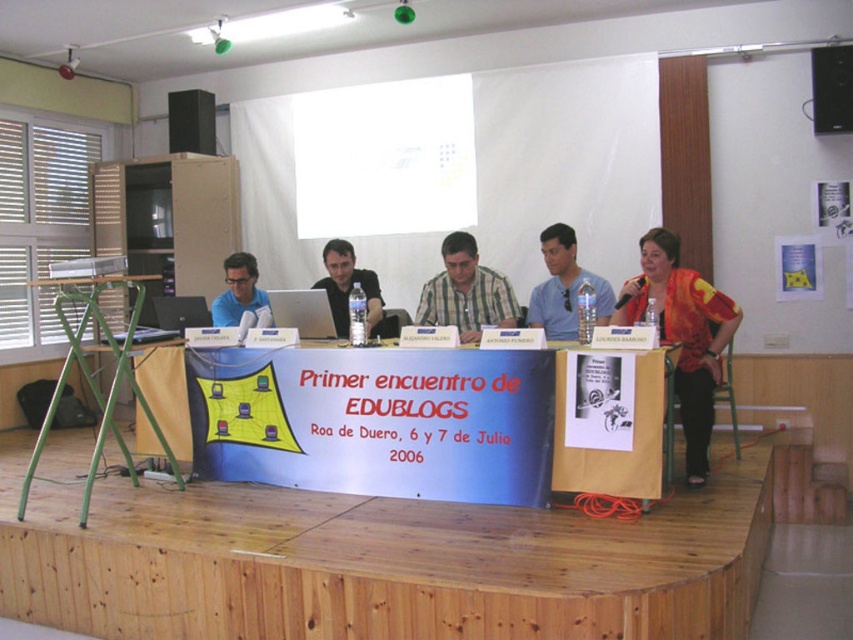
Question: Which is nearer to the orange fabric shirt at right?

Choices:
 (A) white cardboard table at center
 (B) black plastic speaker at upper left
 (C) black plastic speaker at upper right
 (D) green metal table at left

Answer: (A)

Question: Which of these objects is positioned farthest from the matte blue shirt at left?

Choices:
 (A) matte blue shirt at center
 (B) checkered fabric shirt at center
 (C) matte black laptop at center

Answer: (A)

Question: Can you confirm if checkered fabric shirt at center is positioned below silver metallic laptop at center?

Choices:
 (A) no
 (B) yes

Answer: (A)

Question: Is matte black laptop at center to the left of matte blue shirt at left from the viewer's perspective?

Choices:
 (A) no
 (B) yes

Answer: (A)

Question: Is orange fabric shirt at right to the right of matte blue shirt at left from the viewer's perspective?

Choices:
 (A) no
 (B) yes

Answer: (B)

Question: Estimate the real-world distances between objects in this image. Which object is farther from the silver metallic laptop at center?

Choices:
 (A) black plastic speaker at upper right
 (B) green metal table at left

Answer: (A)